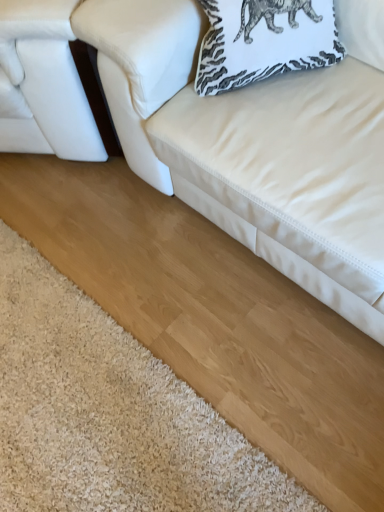
Question: From the image's perspective, is white printed pillow at upper right above or below white leather studio couch at left, which is the first studio couch from left to right?

Choices:
 (A) below
 (B) above

Answer: (A)

Question: Considering the positions of white printed pillow at upper right and white leather studio couch at left, which is the first studio couch from left to right, in the image, is white printed pillow at upper right bigger or smaller than white leather studio couch at left, which is the first studio couch from left to right,?

Choices:
 (A) small
 (B) big

Answer: (A)

Question: Which object is the closest to the white shaggy rug at lower left?

Choices:
 (A) white printed pillow at upper right
 (B) white leather couch at upper right, the 1th studio couch viewed from the right
 (C) white leather studio couch at left, which appears as the 2th studio couch when viewed from the right

Answer: (B)

Question: Which is farther from the white leather studio couch at left, which is the first studio couch from left to right?

Choices:
 (A) white leather couch at upper right, the 1th studio couch viewed from the right
 (B) white shaggy rug at lower left
 (C) white printed pillow at upper right

Answer: (B)